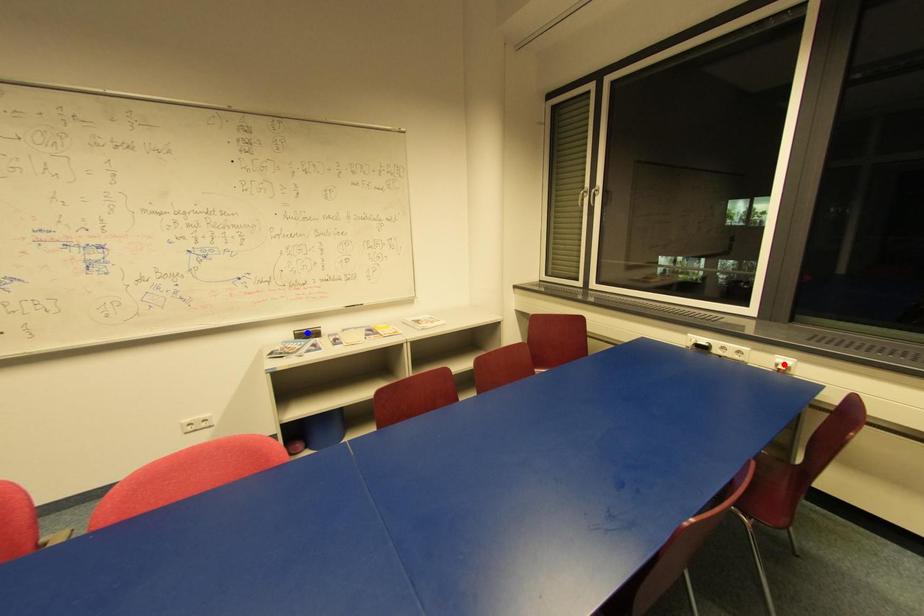
Question: Which of the two points in the image is closer to the camera?

Choices:
 (A) Blue point is closer.
 (B) Red point is closer.

Answer: (B)